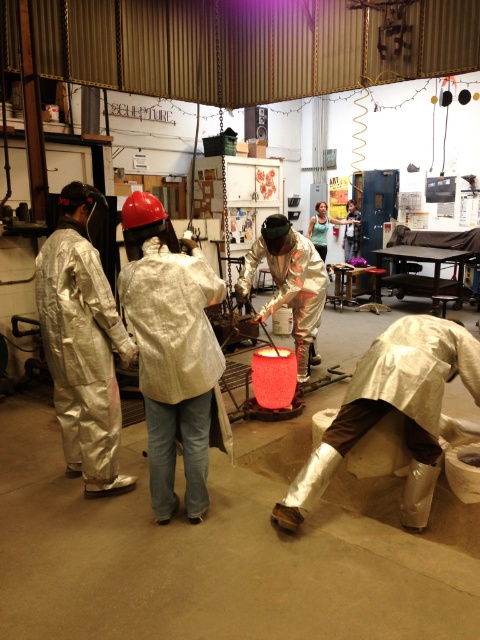
Question: Among these points, which one is nearest to the camera?

Choices:
 (A) (300, 285)
 (B) (110, 364)

Answer: (B)

Question: Among these points, which one is nearest to the camera?

Choices:
 (A) (95, 381)
 (B) (51, 593)

Answer: (B)

Question: Which object is positioned closest to the white reflective suit at center?

Choices:
 (A) silver reflective suit at lower right
 (B) metallic reflective suit at center

Answer: (A)

Question: Is the position of silver reflective suit at left less distant than that of silver reflective suit at lower right?

Choices:
 (A) yes
 (B) no

Answer: (B)

Question: Considering the relative positions of silver reflective suit at left and metallic reflective suit at center in the image provided, where is silver reflective suit at left located with respect to metallic reflective suit at center?

Choices:
 (A) above
 (B) below

Answer: (B)

Question: Is silver reflective suit at left thinner than matte silver helmet at center?

Choices:
 (A) no
 (B) yes

Answer: (B)